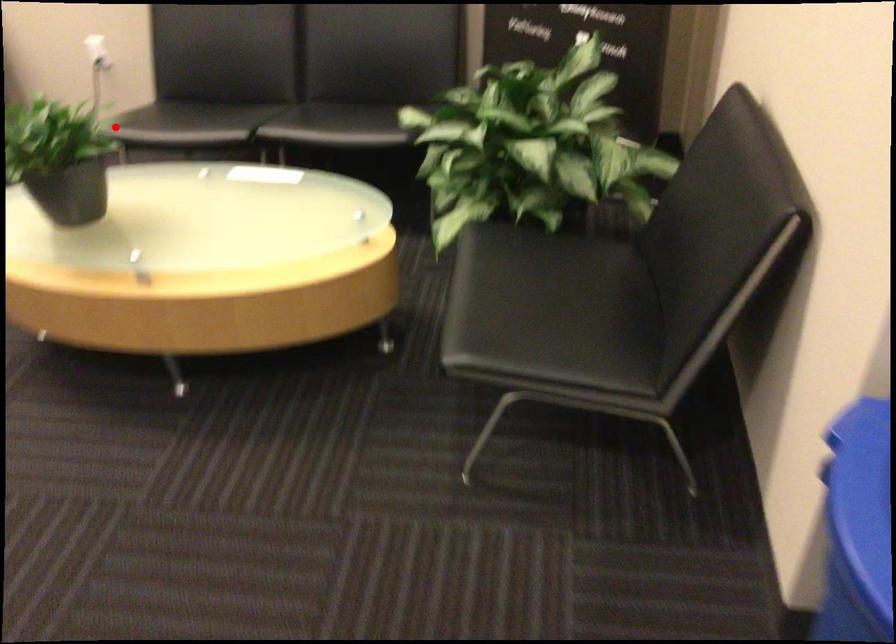
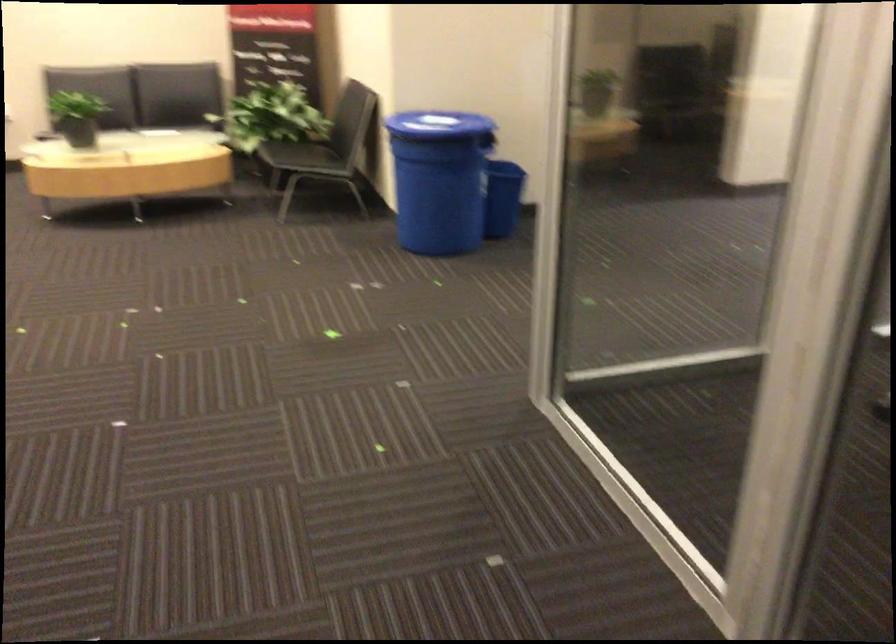
Where in the second image is the point corresponding to the highlighted location from the first image?

(76, 116)